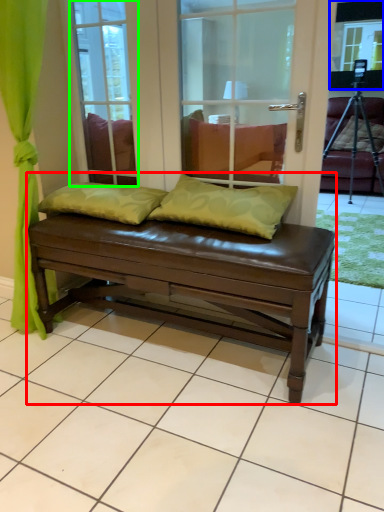
Question: Which object is the closest to the studio couch (highlighted by a red box)? Choose among these: window screen (highlighted by a blue box) or glass door (highlighted by a green box).

Choices:
 (A) window screen
 (B) glass door

Answer: (B)